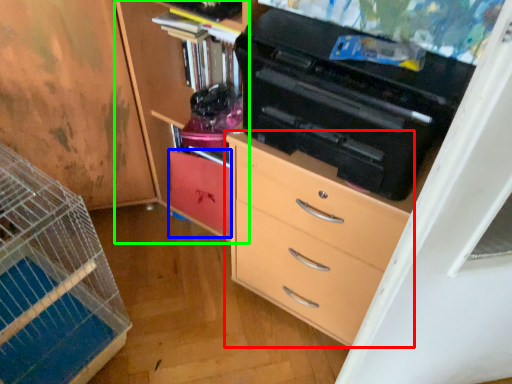
Question: Based on their relative distances, which object is farther from chest of drawers (highlighted by a red box)? Choose from cabinetry (highlighted by a blue box) and cabinetry (highlighted by a green box).

Choices:
 (A) cabinetry
 (B) cabinetry

Answer: (A)